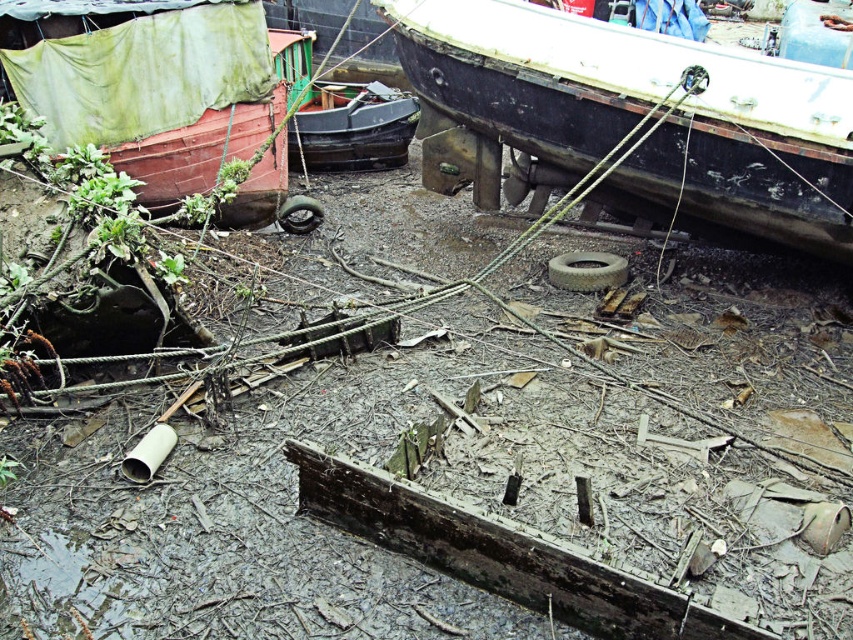
Question: Estimate the real-world distances between objects in this image. Which object is farther from the rusty metal boat at upper right?

Choices:
 (A) red matte boat at upper left
 (B) gray rubber tire at center
 (C) rubber/rough tire at center

Answer: (A)

Question: Is black matte boat at center thinner than rubber/rough tire at center?

Choices:
 (A) no
 (B) yes

Answer: (A)

Question: Which point is farther to the camera?

Choices:
 (A) rusty metal boat at upper right
 (B) gray rubber tire at center
 (C) red matte boat at upper left

Answer: (C)

Question: Observing the image, what is the correct spatial positioning of rusty metal boat at upper right in reference to gray rubber tire at center?

Choices:
 (A) right
 (B) left

Answer: (B)

Question: Which object appears farthest from the camera in this image?

Choices:
 (A) rusty metal boat at upper right
 (B) red matte boat at upper left
 (C) gray rubber tire at center
 (D) rubber/rough tire at center

Answer: (D)

Question: Can you confirm if black matte boat at center is positioned to the left of gray rubber tire at center?

Choices:
 (A) yes
 (B) no

Answer: (A)